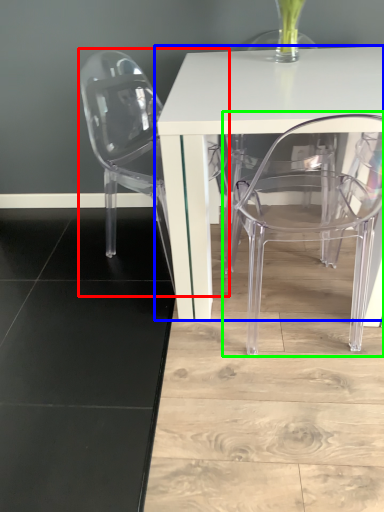
Question: Estimate the real-world distances between objects in this image. Which object is closer to chair (highlighted by a red box), table (highlighted by a blue box) or chair (highlighted by a green box)?

Choices:
 (A) table
 (B) chair

Answer: (A)